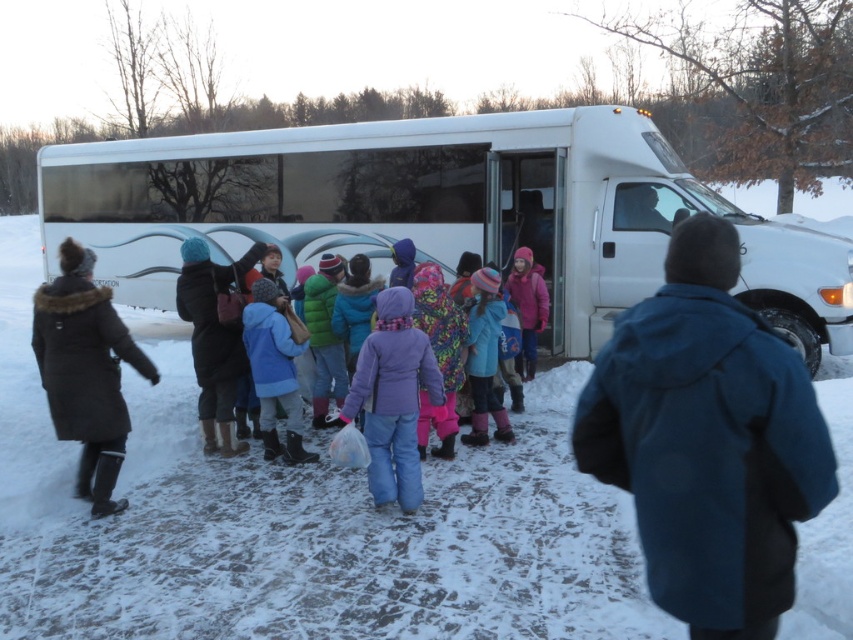
You are a photographer trying to capture a clear shot of the multicolored knitted hat at center and the green fuzzy jacket at center. Based on their positions, which object will appear closer to the camera in the photo?

The multicolored knitted hat at center is in front of the green fuzzy jacket at center, so it will appear closer to the camera in the photo.

In the scene shown: You are a photographer trying to capture a photo of the purple fleece jacket at center and the multicolored knitted hat at center. Which object should you focus on first if you want to include both in the frame without moving the camera?

The purple fleece jacket at center is not as tall as the multicolored knitted hat at center, so you should focus on the multicolored knitted hat at center first to ensure it fits within the frame since it is taller.